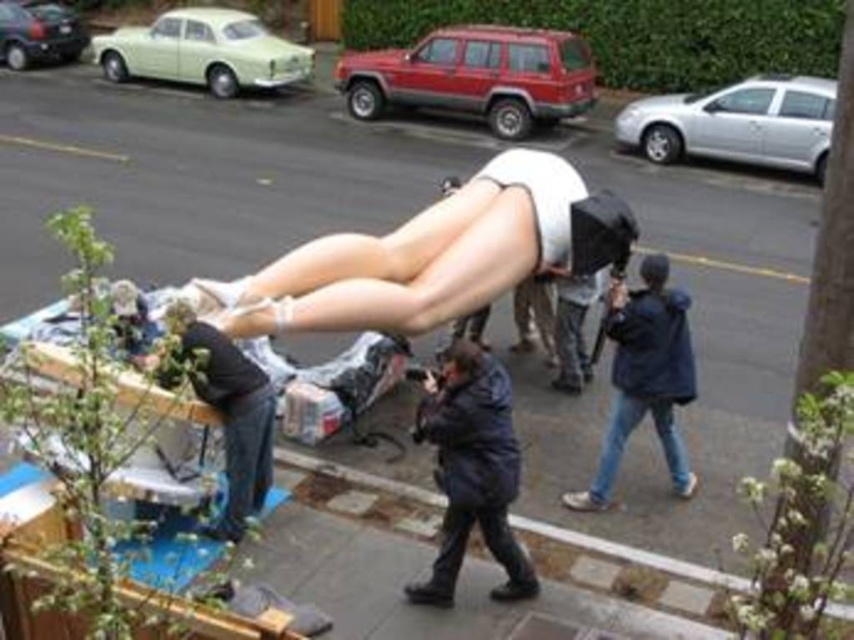
You are a photographer trying to capture a clear shot of the dark blue puffy coat at center and the silver metallic car at upper right. Since the pavement is wet, reflections might interfere. Which object is positioned higher so that its reflection is less likely to be obscured by the wet surface?

The dark blue puffy coat at center is taller than the silver metallic car at upper right, so its reflection is less likely to be obscured by the wet pavement since it is higher up.

You are a delivery robot with a 50 feet maximum delivery range. You are currently positioned near the blue denim jeans at lower right and need to deliver a package to the light green matte car at upper left. Can you complete this delivery within your range?

The distance between the blue denim jeans at lower right and the light green matte car at upper left is 49.72 feet, which is within the robot delivery range of 50 feet. Therefore, the delivery can be completed successfully.

Where is the dark blue puffy coat at center located in the image?

The dark blue puffy coat at center is located at point (x=471, y=468) in the image.